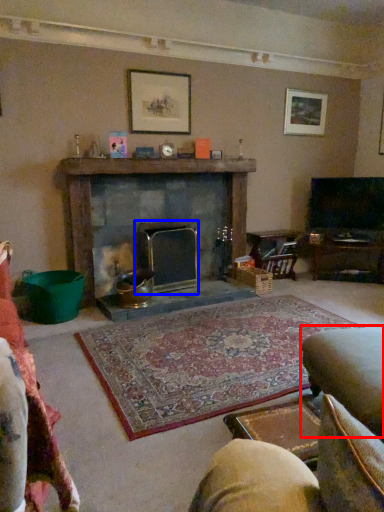
Question: Which point is closer to the camera, swivel chair (highlighted by a red box) or fireplace (highlighted by a blue box)?

Choices:
 (A) swivel chair
 (B) fireplace

Answer: (A)